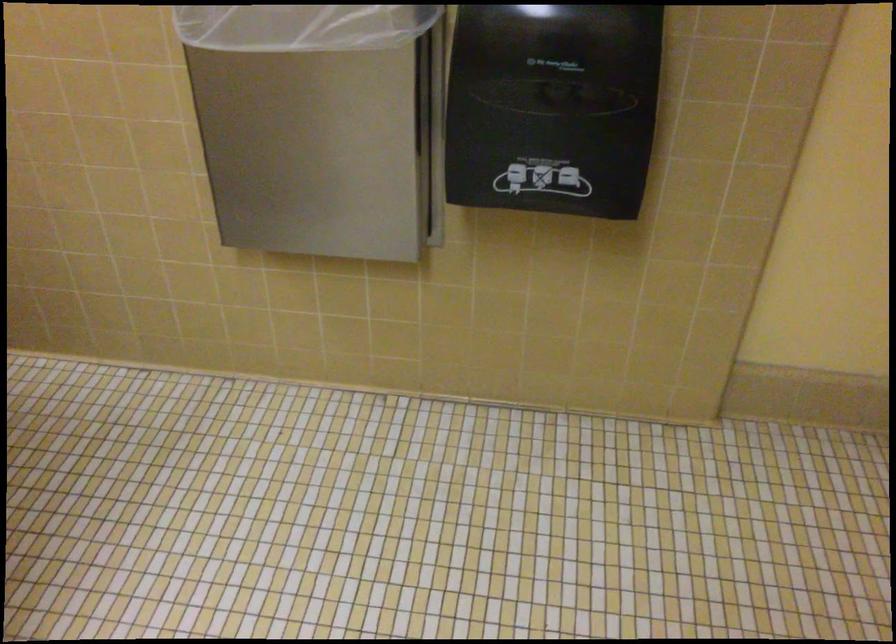
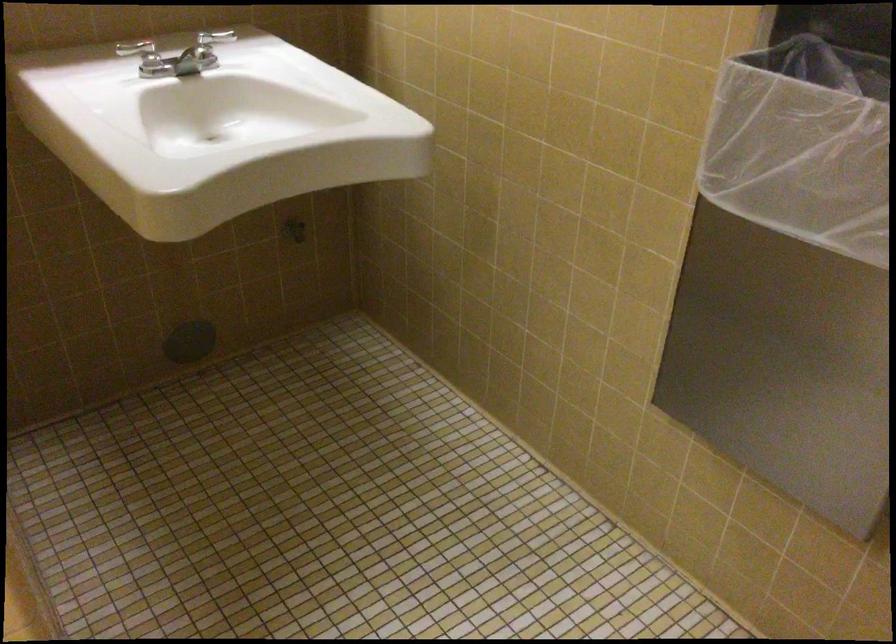
Question: The camera is either moving clockwise (left) or counter-clockwise (right) around the object. The first image is from the beginning of the video and the second image is from the end. Is the camera moving left or right when shooting the video?

Choices:
 (A) Left
 (B) Right

Answer: (B)